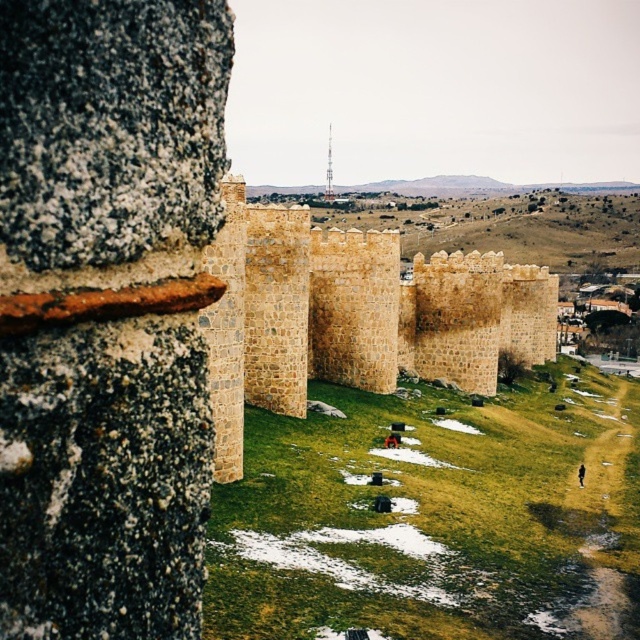
Question: Does brown stone wall at center have a smaller size compared to smooth concrete tower at center?

Choices:
 (A) yes
 (B) no

Answer: (B)

Question: Where is brown stone wall at center located in relation to smooth concrete tower at center in the image?

Choices:
 (A) right
 (B) left

Answer: (A)

Question: Is brown stone wall at center closer to the viewer compared to smooth concrete tower at center?

Choices:
 (A) yes
 (B) no

Answer: (A)

Question: Which point is closer to the camera?

Choices:
 (A) (324, 177)
 (B) (212, 404)

Answer: (B)

Question: Which of the following is the farthest from the observer?

Choices:
 (A) (294, 364)
 (B) (330, 196)

Answer: (B)

Question: Which object appears closest to the camera in this image?

Choices:
 (A) brown stone wall at center
 (B) smooth concrete tower at center

Answer: (A)